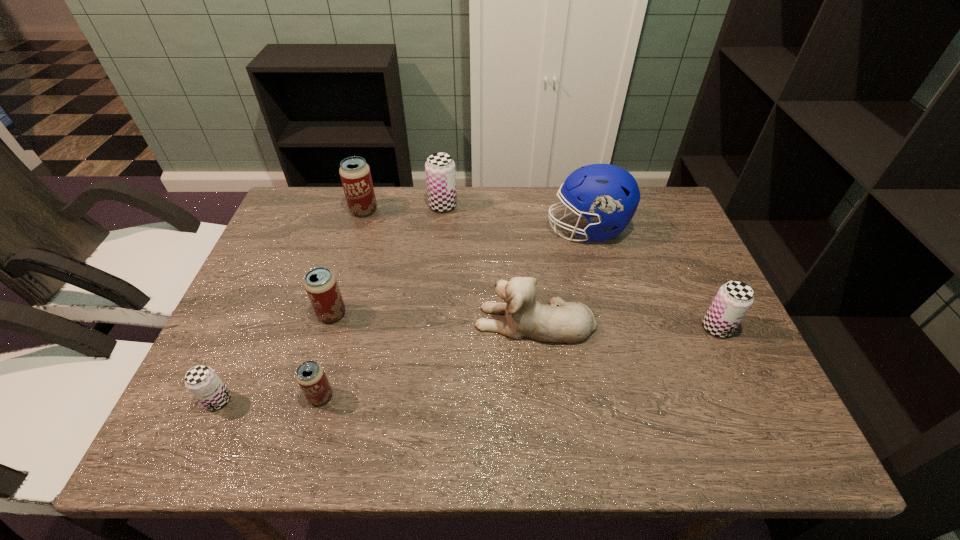
Locate an element on the screen. blue football helmet is located at coordinates (606, 195).

Locate an element on the screen. football helmet is located at coordinates (606, 195).

I want to click on the biggest red beer can, so click(x=355, y=174).

Where is `the farthest purple beer can`? the farthest purple beer can is located at coordinates (440, 168).

The height and width of the screenshot is (540, 960). What are the coordinates of `the fifth beer can from left to right` in the screenshot? It's located at (440, 168).

The image size is (960, 540). I want to click on puppy, so click(570, 322).

What are the coordinates of `the second smallest red beer can` in the screenshot? It's located at (321, 285).

Identify the location of the rightmost object. This screenshot has height=540, width=960. (733, 300).

Locate an element on the screen. This screenshot has height=540, width=960. the rightmost purple beer can is located at coordinates (733, 300).

This screenshot has height=540, width=960. Find the location of `the leftmost purple beer can`. the leftmost purple beer can is located at coordinates (202, 381).